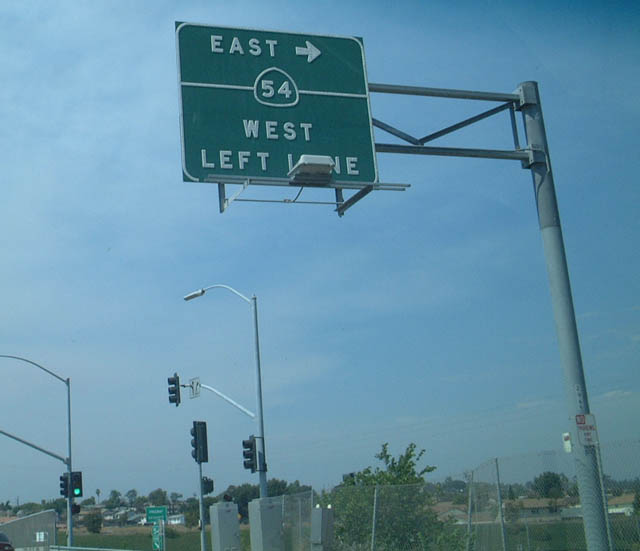
Where is `plant`? The height and width of the screenshot is (551, 640). plant is located at coordinates (386, 501), (364, 509), (402, 469), (402, 517), (239, 494).